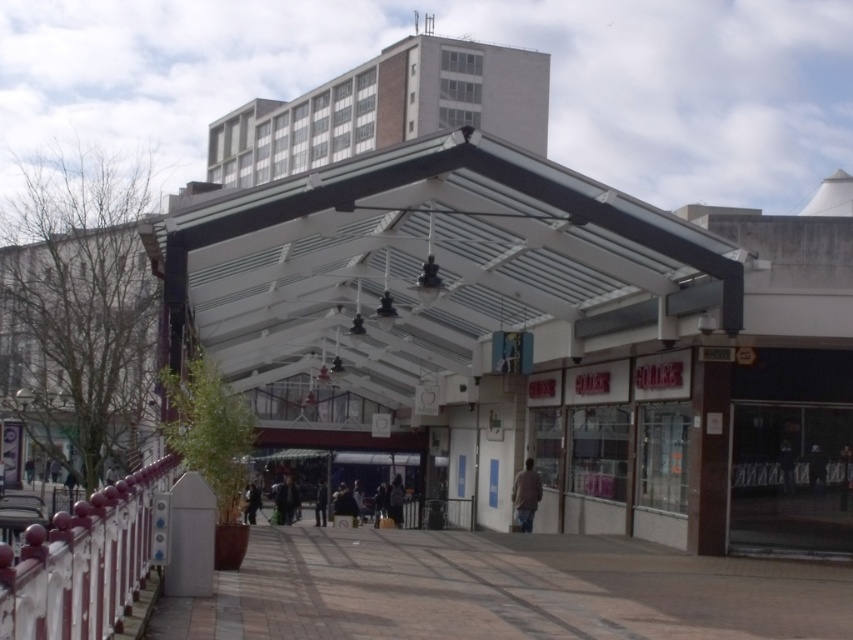
Question: Does light brown fabric jacket at center appear over dark gray jacket at center?

Choices:
 (A) yes
 (B) no

Answer: (A)

Question: Is light brown fabric jacket at center below dark gray jacket at center?

Choices:
 (A) yes
 (B) no

Answer: (B)

Question: Is brown tile pavement at lower center wider than dark gray jacket at center?

Choices:
 (A) yes
 (B) no

Answer: (A)

Question: Which object appears farthest from the camera in this image?

Choices:
 (A) brown tile pavement at lower center
 (B) light brown fabric jacket at center
 (C) dark gray fabric jacket at center

Answer: (C)

Question: Which of these objects is positioned closest to the dark gray fabric jacket at center?

Choices:
 (A) light brown fabric jacket at center
 (B) dark gray jacket at center

Answer: (B)

Question: Which point is closer to the camera taking this photo?

Choices:
 (A) (515, 484)
 (B) (717, 592)
 (C) (390, 497)

Answer: (B)